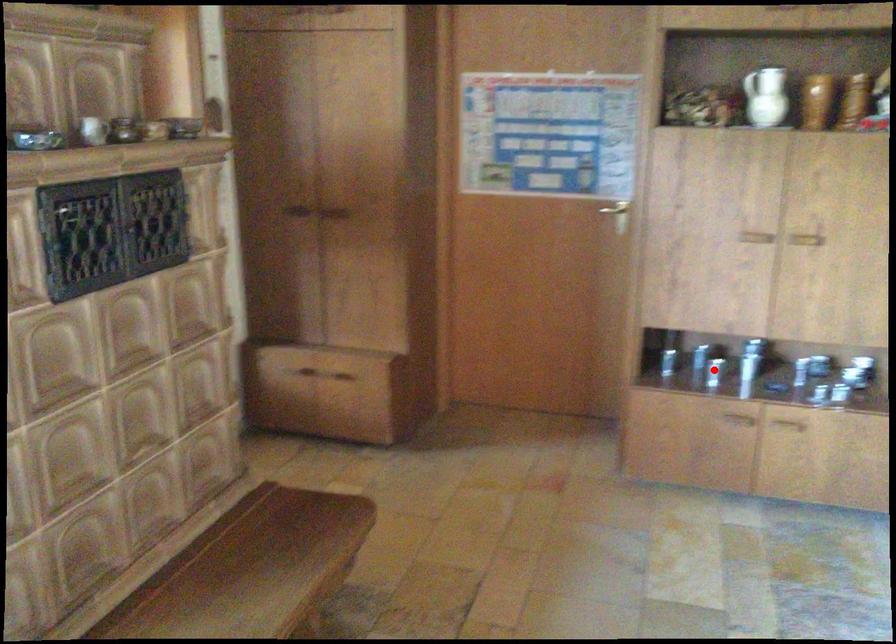
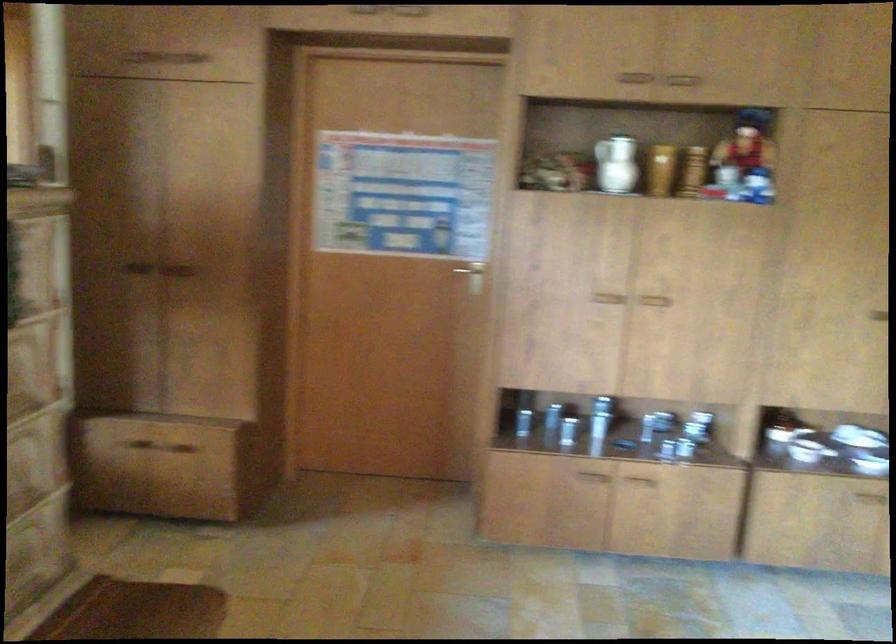
Locate, in the second image, the point that corresponds to the highlighted location in the first image.

(572, 431)